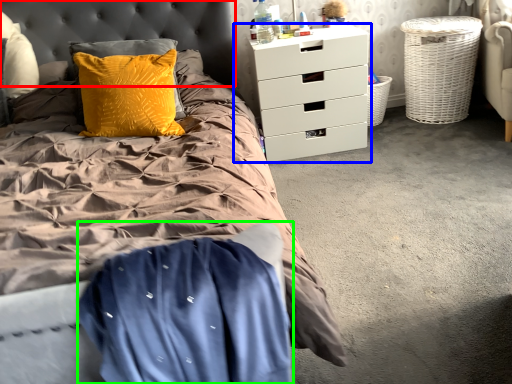
Question: Which is nearer to the headboard (highlighted by a red box)? chest of drawers (highlighted by a blue box) or blanket (highlighted by a green box).

Choices:
 (A) chest of drawers
 (B) blanket

Answer: (A)